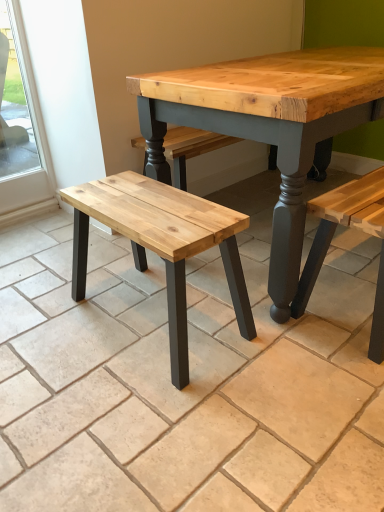
What do you see at coordinates (183, 389) in the screenshot? I see `natural wood bench at center` at bounding box center [183, 389].

Looking at this image, measure the distance between point [20,65] and camera.

Point [20,65] is 2.15 meters from camera.

The image size is (384, 512). Identify the location of natural wood bench at left. (162, 244).

Would you say clear glass window at left is a long distance from natural wood bench at center?

Yes, clear glass window at left and natural wood bench at center are located far from each other.

Is clear glass window at left bigger than natural wood bench at center?

No.

Measure the distance from clear glass window at left to natural wood bench at center.

6.85 feet.

Is clear glass window at left outside of natural wood bench at center?

Yes, clear glass window at left is not within natural wood bench at center.

Is natural wood bench at left wider than natural wood bench at center?

No.

Is natural wood bench at left outside of natural wood bench at center?

Yes, natural wood bench at left is not within natural wood bench at center.

Find the location of a particular element. The height and width of the screenshot is (512, 384). stool that is below the natural wood bench at center (from the image's perspective) is located at coordinates tap(162, 244).

Based on their positions, is natural wood bench at left located to the left or right of natural wood bench at center?

natural wood bench at left is positioned on natural wood bench at center's left side.

Which object is closer to the camera taking this photo, natural wood bench at center or clear glass window at left?

natural wood bench at center is in front.

Is natural wood bench at center thinner than clear glass window at left?

Incorrect, the width of natural wood bench at center is not less than that of clear glass window at left.

Consider the image. Is natural wood bench at center oriented away from clear glass window at left?

No, clear glass window at left is not at the back of natural wood bench at center.

From the image's perspective, is natural wood bench at center above or below clear glass window at left?

Clearly, from the image's perspective, natural wood bench at center is below clear glass window at left.

From the image's perspective, is natural wood bench at center above or below natural wood bench at left?

natural wood bench at center is above natural wood bench at left.

The image size is (384, 512). Identify the location of tile below the natural wood bench at left (from a real-world perspective). (183, 389).

Is natural wood bench at center bigger or smaller than natural wood bench at left?

In the image, natural wood bench at center appears to be larger than natural wood bench at left.

Is natural wood bench at center facing towards natural wood bench at left?

No, natural wood bench at center is not turned towards natural wood bench at left.

Is natural wood bench at left inside or outside of clear glass window at left?

natural wood bench at left is not inside clear glass window at left, it's outside.

The image size is (384, 512). Find the location of `stool that is on the right side of clear glass window at left`. stool that is on the right side of clear glass window at left is located at coordinates (162, 244).

Is natural wood bench at left to the left of clear glass window at left from the viewer's perspective?

No.

Is natural wood bench at left beside clear glass window at left?

natural wood bench at left and clear glass window at left are clearly separated.

Considering the sizes of objects clear glass window at left and natural wood bench at left in the image provided, who is taller, clear glass window at left or natural wood bench at left?

clear glass window at left is taller.

From a real-world perspective, who is located higher, clear glass window at left or natural wood bench at left?

clear glass window at left.

Looking at this image, how far apart are clear glass window at left and natural wood bench at left?

6.92 feet.

Does point (7, 56) appear closer or farther from the camera than point (157, 210)?

Point (7, 56) is farther from the camera than point (157, 210).

Where is `window behind the natural wood bench at center`? window behind the natural wood bench at center is located at coordinates (15, 104).

Locate an element on the screen. Image resolution: width=384 pixels, height=512 pixels. stool that appears on the left of natural wood bench at center is located at coordinates (162, 244).

From the image, which object appears to be farther from natural wood bench at center, natural wood bench at left or clear glass window at left?

Based on the image, clear glass window at left appears to be further to natural wood bench at center.

Looking at this image, based on their spatial positions, is clear glass window at left or natural wood bench at center closer to natural wood bench at left?

Among the two, natural wood bench at center is located nearer to natural wood bench at left.

When comparing their distances from natural wood bench at center, does clear glass window at left or natural wood bench at left seem further?

Based on the image, clear glass window at left appears to be further to natural wood bench at center.

When comparing their distances from natural wood bench at left, does natural wood bench at center or clear glass window at left seem closer?

natural wood bench at center is closer to natural wood bench at left.

When comparing their distances from clear glass window at left, does natural wood bench at left or natural wood bench at center seem closer?

natural wood bench at center is closer to clear glass window at left.

Considering their positions, is natural wood bench at center positioned closer to clear glass window at left than natural wood bench at left?

The object closer to clear glass window at left is natural wood bench at center.

At what (x,y) coordinates should I click in order to perform the action: click on stool located between natural wood bench at center and clear glass window at left in the depth direction. Please return your answer as a coordinate pair (x, y). Looking at the image, I should click on (162, 244).